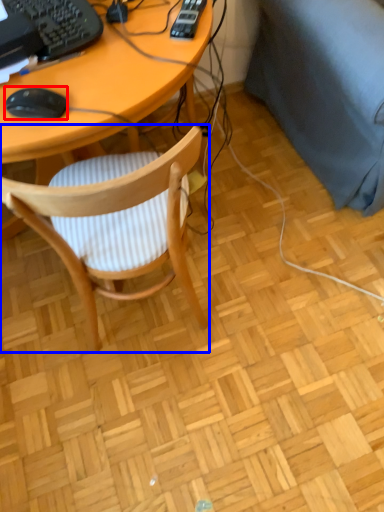
Question: Which object appears closest to the camera in this image, mouse (highlighted by a red box) or chair (highlighted by a blue box)?

Choices:
 (A) mouse
 (B) chair

Answer: (B)